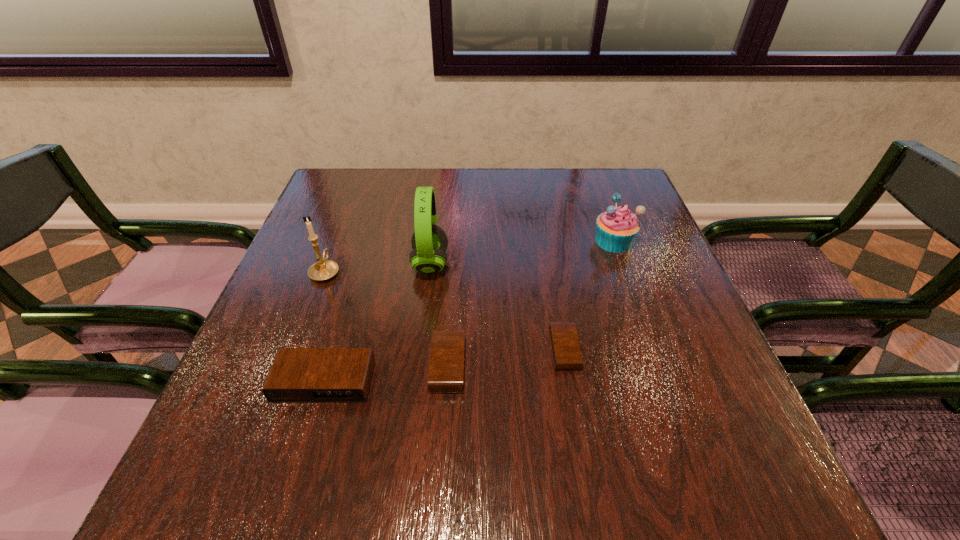
Image resolution: width=960 pixels, height=540 pixels. I want to click on free space between the second alarm clock from left to right and the tallest object, so click(x=440, y=314).

Locate an element on the screen. free area in between the headset and the second object from right to left is located at coordinates (497, 306).

In order to click on free space between the candle holder and the shortest object in this screenshot , I will do `click(445, 310)`.

Where is `vacant area between the fifth tallest object and the leftmost alarm clock`? The image size is (960, 540). vacant area between the fifth tallest object and the leftmost alarm clock is located at coordinates (386, 373).

Locate an element on the screen. This screenshot has height=540, width=960. vacant space in between the third tallest object and the rightmost alarm clock is located at coordinates tap(589, 295).

This screenshot has height=540, width=960. I want to click on vacant space that's between the third tallest object and the fifth tallest object, so click(531, 303).

Where is `free space that is in between the fifth shortest object and the shortest alarm clock`? The image size is (960, 540). free space that is in between the fifth shortest object and the shortest alarm clock is located at coordinates (445, 310).

Find the location of a particular element. Image resolution: width=960 pixels, height=540 pixels. free space between the candle holder and the tallest object is located at coordinates (378, 267).

Locate an element on the screen. Image resolution: width=960 pixels, height=540 pixels. the closest object relative to the fourth shortest object is located at coordinates (566, 352).

Choose which object is the fourth nearest neighbor to the shortest alarm clock. Please provide its 2D coordinates. Your answer should be formatted as a tuple, i.e. [(x, y)], where the tuple contains the x and y coordinates of a point satisfying the conditions above.

[(298, 375)]